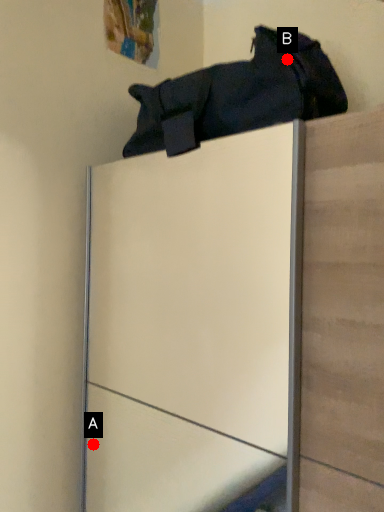
Question: Two points are circled on the image, labeled by A and B beside each circle. Which point is further to the camera?

Choices:
 (A) A is further
 (B) B is further

Answer: (A)